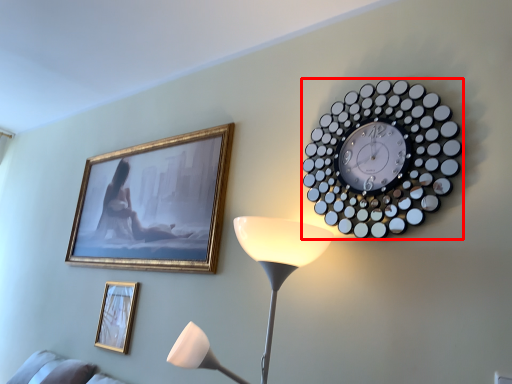
Question: From the image's perspective, where is wall clock (annotated by the red box) located in relation to picture frame in the image?

Choices:
 (A) below
 (B) above

Answer: (B)